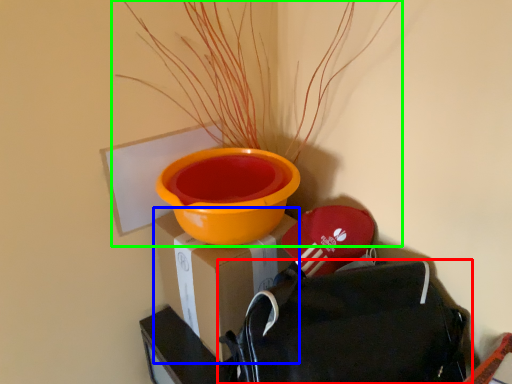
Question: Based on their relative distances, which object is nearer to backpack (highlighted by a red box)? Choose from cardboard box (highlighted by a blue box) and houseplant (highlighted by a green box).

Choices:
 (A) cardboard box
 (B) houseplant

Answer: (A)